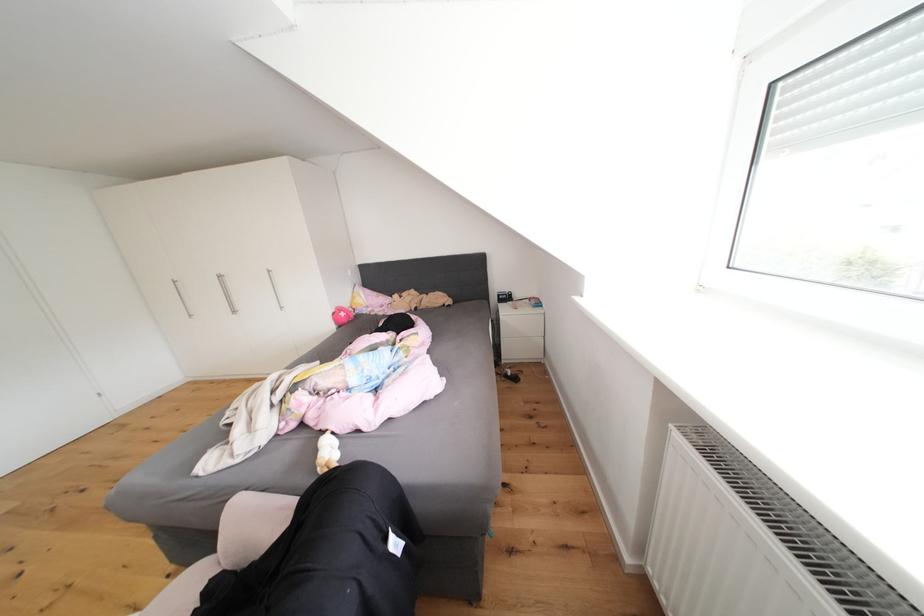
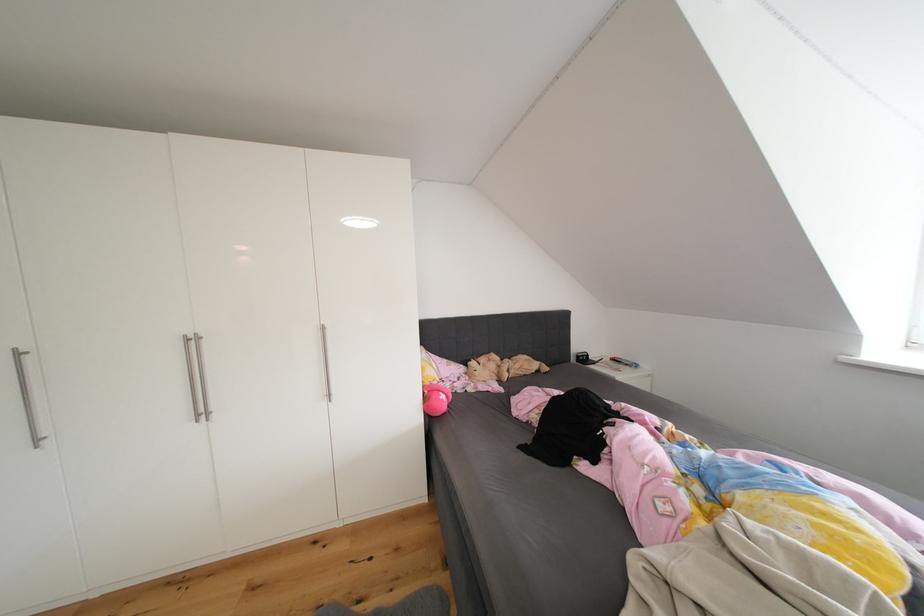
The point at (229,281) is marked in the first image. Where is the corresponding point in the second image?

(201, 344)